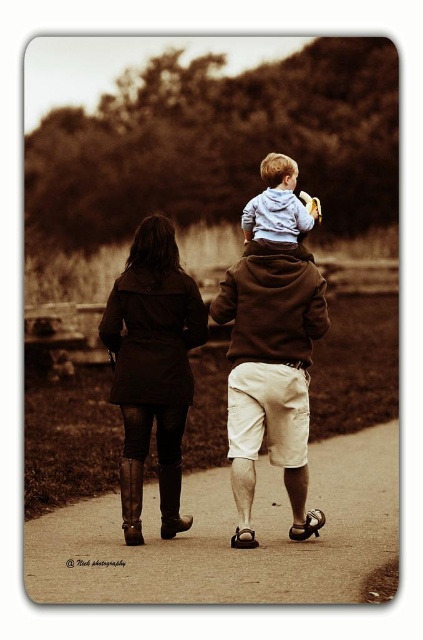
Question: From the image, what is the correct spatial relationship of smooth asphalt path at center in relation to matte brown hoodie at center?

Choices:
 (A) above
 (B) below

Answer: (B)

Question: Which point is closer to the camera?

Choices:
 (A) smooth asphalt path at center
 (B) dark brown leather coat at center
 (C) light blue hoodie at center
 (D) matte brown hoodie at center

Answer: (A)

Question: Does smooth asphalt path at center appear over light blue hoodie at center?

Choices:
 (A) no
 (B) yes

Answer: (A)

Question: Which object appears closest to the camera in this image?

Choices:
 (A) dark brown leather coat at center
 (B) smooth asphalt path at center
 (C) matte brown hoodie at center

Answer: (B)

Question: Does smooth asphalt path at center come in front of matte brown hoodie at center?

Choices:
 (A) yes
 (B) no

Answer: (A)

Question: Which object appears farthest from the camera in this image?

Choices:
 (A) smooth asphalt path at center
 (B) matte brown hoodie at center
 (C) light blue hoodie at center

Answer: (C)